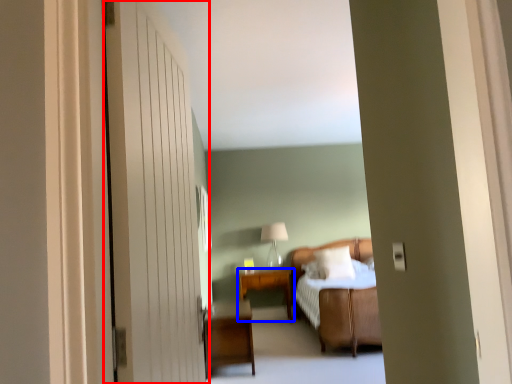
Question: Which object is further to the camera taking this photo, door (highlighted by a red box) or table (highlighted by a blue box)?

Choices:
 (A) door
 (B) table

Answer: (B)